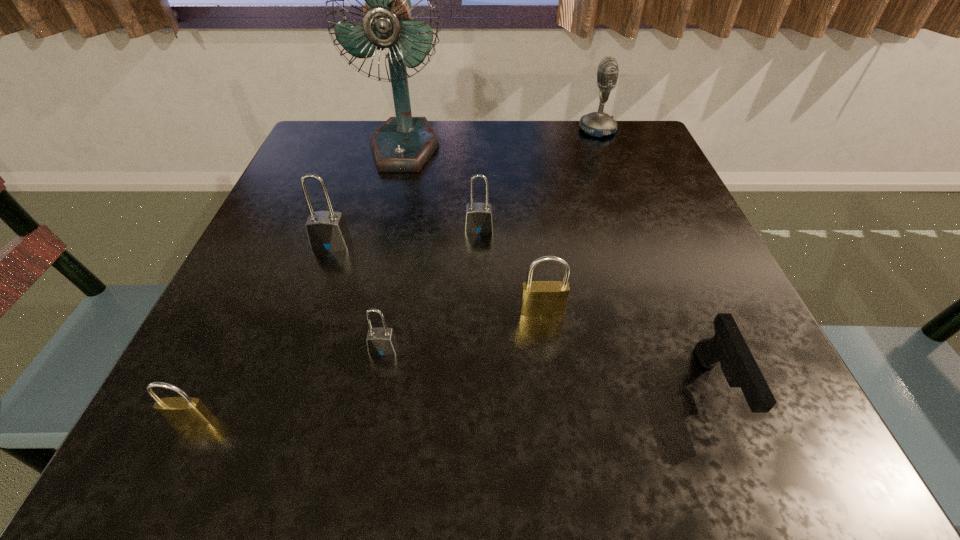
I want to click on the third padlock from right to left, so click(x=381, y=341).

Where is `the fourth farthest padlock`? This screenshot has height=540, width=960. the fourth farthest padlock is located at coordinates (381, 341).

Find the location of a particular element. The width and height of the screenshot is (960, 540). the nearer brass padlock is located at coordinates (183, 411).

At what (x,y) coordinates should I click in order to perform the action: click on the smaller brass padlock. Please return your answer as a coordinate pair (x, y). Image resolution: width=960 pixels, height=540 pixels. Looking at the image, I should click on (183, 411).

At what (x,y) coordinates should I click in order to perform the action: click on vacant space situated 0.400m in front of the tallest object where the wind blows. Please return your answer as a coordinate pair (x, y). Looking at the image, I should click on (367, 311).

You are a GUI agent. You are given a task and a screenshot of the screen. Output one action in this format:
    pyautogui.click(x=<x>, y=<y>)
    Task: Click on the vacant space located on the front-facing side of the microphone
    The image size is (960, 540).
    Given the screenshot: What is the action you would take?
    pyautogui.click(x=531, y=130)

Where is `free space located 0.380m on the front-facing side of the microphone`? The width and height of the screenshot is (960, 540). free space located 0.380m on the front-facing side of the microphone is located at coordinates (428, 130).

Where is `free space located on the front-facing side of the microphone`? The image size is (960, 540). free space located on the front-facing side of the microphone is located at coordinates (420, 130).

Where is `vacant point located on the shackle of the second farthest gray padlock`? The height and width of the screenshot is (540, 960). vacant point located on the shackle of the second farthest gray padlock is located at coordinates (316, 288).

What are the coordinates of `vacant space located 0.350m on the shackle of the third farthest object` in the screenshot? It's located at coord(479,404).